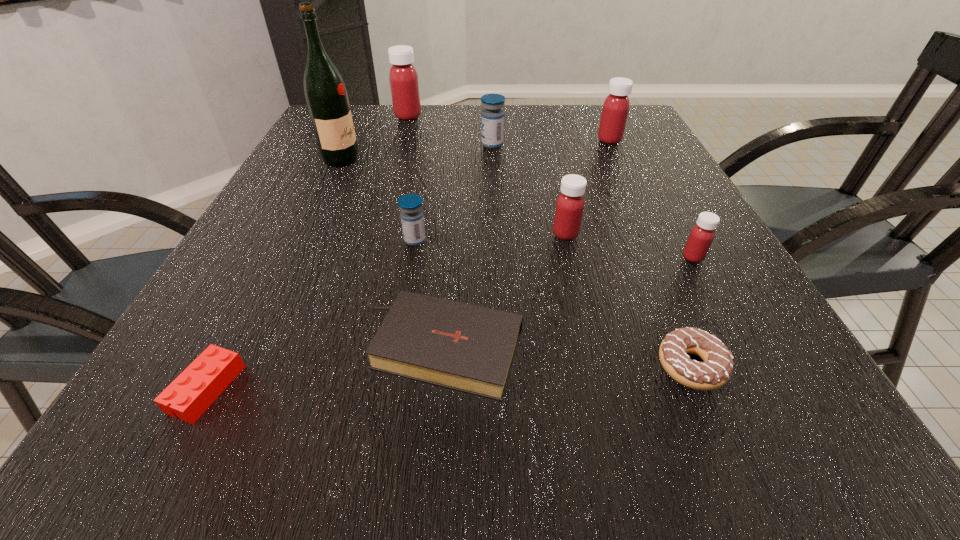
Identify the location of free space that satisfies the following two spatial constraints: 1. on the back side of the red Lego; 2. on the right side of the nearest medicine. This screenshot has height=540, width=960. pyautogui.click(x=276, y=257).

Locate an element on the screen. vacant region that satisfies the following two spatial constraints: 1. on the back side of the second smallest red medicine; 2. on the left side of the smaller blue medicine is located at coordinates pos(416,234).

Find the location of `free spot that satisfies the following two spatial constraints: 1. on the front side of the chocolate doughnut; 2. on the left side of the farthest red medicine`. free spot that satisfies the following two spatial constraints: 1. on the front side of the chocolate doughnut; 2. on the left side of the farthest red medicine is located at coordinates (336, 366).